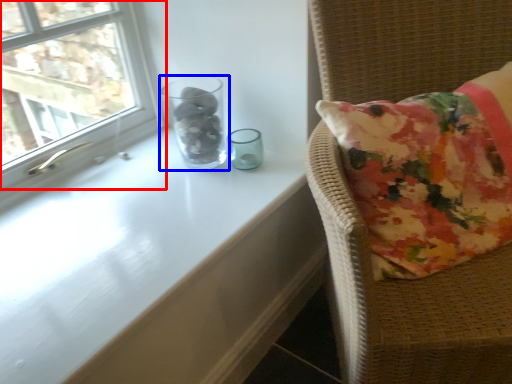
Question: Which of the following is the farthest to the observer, window (highlighted by a red box) or glass vase (highlighted by a blue box)?

Choices:
 (A) window
 (B) glass vase

Answer: (B)